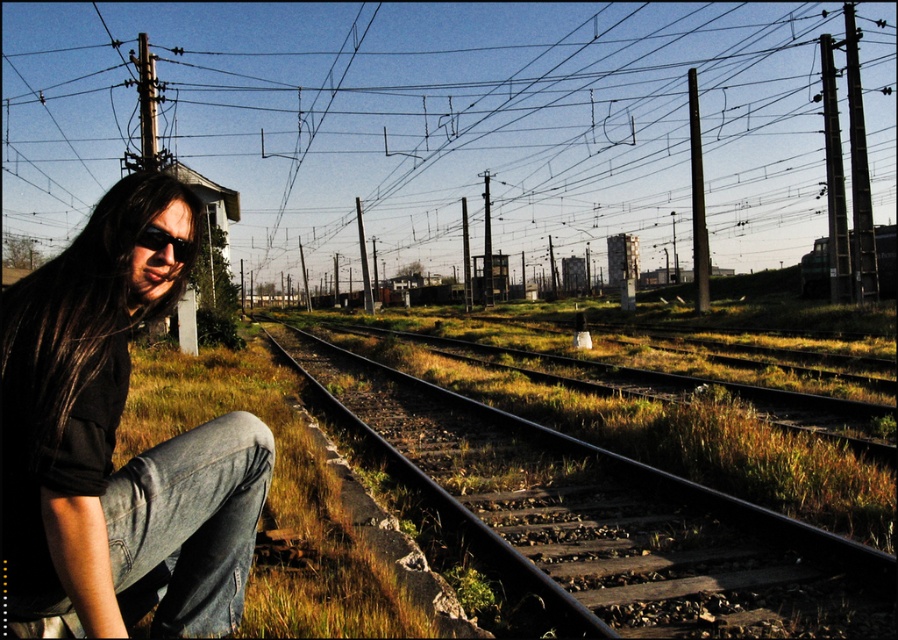
Question: Can you confirm if metal/smooth train track at center is positioned to the left of brown matte hair at left?

Choices:
 (A) yes
 (B) no

Answer: (B)

Question: Where is metal/smooth train track at center located in relation to black matte sunglasses at left in the image?

Choices:
 (A) below
 (B) above

Answer: (A)

Question: Which is farther from the metal/smooth train track at center?

Choices:
 (A) denim jeans at left
 (B) brown matte hair at left

Answer: (B)

Question: Which object is positioned closest to the denim jeans at left?

Choices:
 (A) black matte sunglasses at left
 (B) metallic wire at upper center
 (C) brown matte hair at left
 (D) metal/smooth train track at center

Answer: (C)

Question: Does metal/smooth train track at center lie in front of black matte sunglasses at left?

Choices:
 (A) no
 (B) yes

Answer: (A)

Question: Which is nearer to the brown matte hair at left?

Choices:
 (A) metallic wire at upper center
 (B) denim jeans at left
 (C) metal/smooth train track at center
 (D) black matte sunglasses at left

Answer: (D)